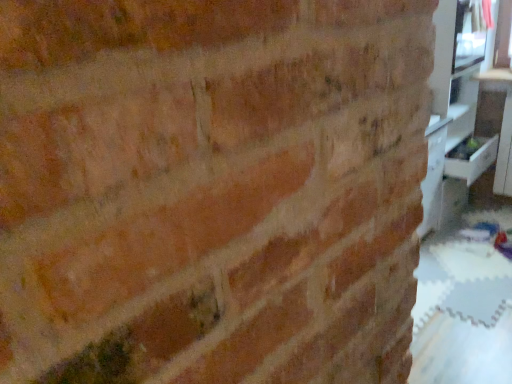
Where is `white glossy drawer at right`? white glossy drawer at right is located at coordinates (473, 162).

What is the approximate width of white glossy drawer at right?

white glossy drawer at right is 12.73 inches in width.

Describe the element at coordinates (473, 162) in the screenshot. The height and width of the screenshot is (384, 512). I see `white glossy drawer at right` at that location.

Measure the distance between white glossy drawer at right and camera.

The distance of white glossy drawer at right from camera is 10.11 feet.

This screenshot has width=512, height=384. I want to click on white glossy entertainment center at right, so click(455, 113).

This screenshot has width=512, height=384. What do you see at coordinates (455, 113) in the screenshot? I see `white glossy entertainment center at right` at bounding box center [455, 113].

Identify the location of white glossy drawer at right. The image size is (512, 384). (473, 162).

Is white glossy drawer at right to the right of white glossy entertainment center at right from the viewer's perspective?

Correct, you'll find white glossy drawer at right to the right of white glossy entertainment center at right.

Does white glossy drawer at right lie in front of white glossy entertainment center at right?

No, white glossy drawer at right is further to the viewer.

Is point (490, 158) positioned behind point (487, 152)?

Yes, point (490, 158) is farther from viewer.

From the image's perspective, which one is positioned higher, white glossy drawer at right or white glossy entertainment center at right?

white glossy entertainment center at right.

From a real-world perspective, which is physically below, white glossy drawer at right or white glossy entertainment center at right?

white glossy drawer at right is physically lower.

Considering the relative sizes of white glossy drawer at right and white glossy entertainment center at right in the image provided, is white glossy drawer at right wider than white glossy entertainment center at right?

In fact, white glossy drawer at right might be narrower than white glossy entertainment center at right.

Is white glossy drawer at right taller than white glossy entertainment center at right?

In fact, white glossy drawer at right may be shorter than white glossy entertainment center at right.

Between white glossy drawer at right and white glossy entertainment center at right, which one has larger size?

With larger size is white glossy entertainment center at right.

Is white glossy drawer at right situated inside white glossy entertainment center at right or outside?

white glossy drawer at right is located inside white glossy entertainment center at right.

Are white glossy drawer at right and white glossy entertainment center at right far apart?

That's not correct — white glossy drawer at right is a little close to white glossy entertainment center at right.

Is white glossy drawer at right looking in the opposite direction of white glossy entertainment center at right?

Yes, white glossy drawer at right is positioned with its back facing white glossy entertainment center at right.

In order to click on drawer located on the right of white glossy entertainment center at right in this screenshot , I will do `click(473, 162)`.

In the image, is white glossy entertainment center at right on the left side or the right side of white glossy drawer at right?

From the image, it's evident that white glossy entertainment center at right is to the left of white glossy drawer at right.

Is white glossy entertainment center at right closer to camera compared to white glossy drawer at right?

Yes.

Is point (475, 72) farther from viewer compared to point (445, 165)?

Yes, it is.

From the image's perspective, who appears lower, white glossy entertainment center at right or white glossy drawer at right?

white glossy drawer at right is shown below in the image.

From a real-world perspective, who is located lower, white glossy entertainment center at right or white glossy drawer at right?

white glossy drawer at right is physically lower.

Is white glossy entertainment center at right wider than white glossy drawer at right?

Indeed, white glossy entertainment center at right has a greater width compared to white glossy drawer at right.

Can you confirm if white glossy entertainment center at right is shorter than white glossy drawer at right?

Incorrect, the height of white glossy entertainment center at right does not fall short of that of white glossy drawer at right.

Between white glossy entertainment center at right and white glossy drawer at right, which one has larger size?

With larger size is white glossy entertainment center at right.

Is white glossy entertainment center at right surrounding white glossy drawer at right?

Yes, white glossy entertainment center at right is surrounding white glossy drawer at right.

Is white glossy entertainment center at right placed right next to white glossy drawer at right?

No, white glossy entertainment center at right is not beside white glossy drawer at right.

Is white glossy entertainment center at right turned away from white glossy drawer at right?

Yes.

How different are the orientations of white glossy entertainment center at right and white glossy drawer at right in degrees?

They differ by 0.000916 degrees in their facing directions.

Find the location of a particular element. The width and height of the screenshot is (512, 384). drawer on the right of white glossy entertainment center at right is located at coordinates (473, 162).

The image size is (512, 384). There is a white glossy drawer at right. Find the location of `entertainment center above it (from a real-world perspective)`. entertainment center above it (from a real-world perspective) is located at coordinates coord(455,113).

Find the location of a particular element. Image resolution: width=512 pixels, height=384 pixels. drawer that is on the right side of white glossy entertainment center at right is located at coordinates (473, 162).